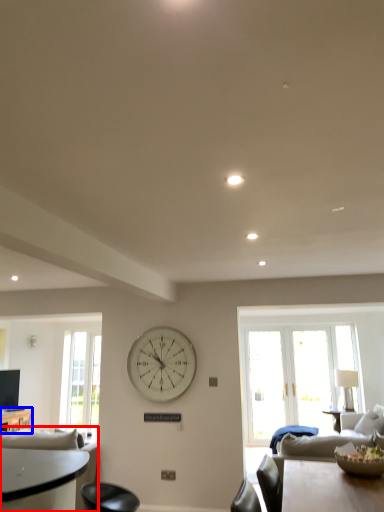
Question: Which of the following is the closest to the observer, studio couch (highlighted by a red box) or table (highlighted by a blue box)?

Choices:
 (A) studio couch
 (B) table

Answer: (A)